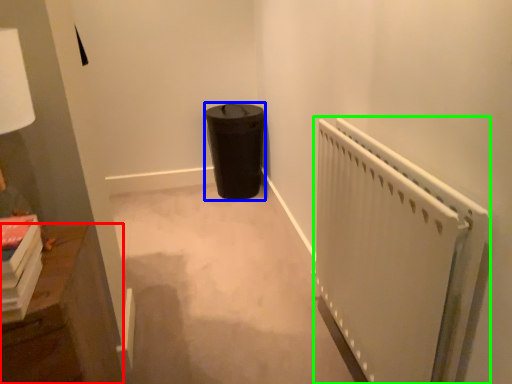
Question: Estimate the real-world distances between objects in this image. Which object is farther from furniture (highlighted by a red box), garbage (highlighted by a blue box) or radiator (highlighted by a green box)?

Choices:
 (A) garbage
 (B) radiator

Answer: (A)